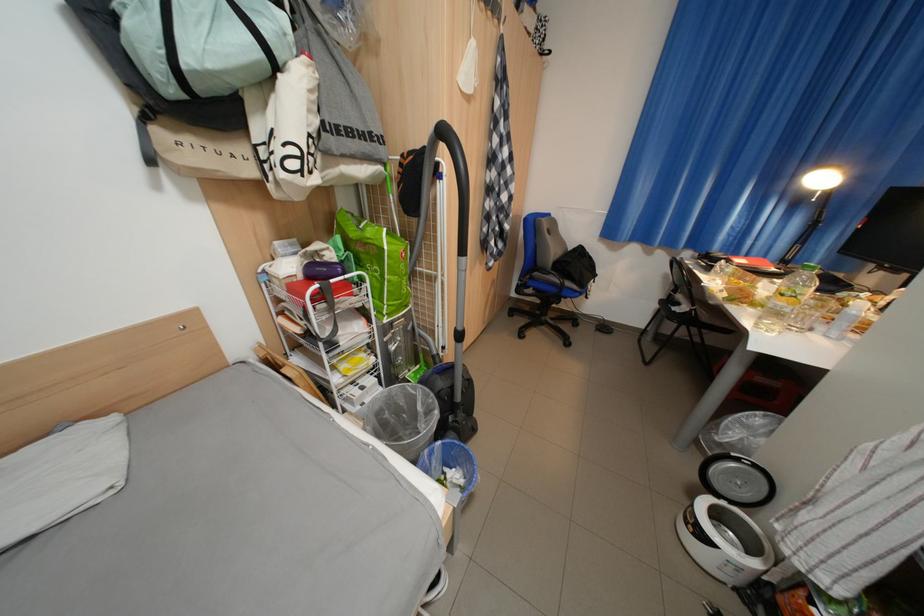
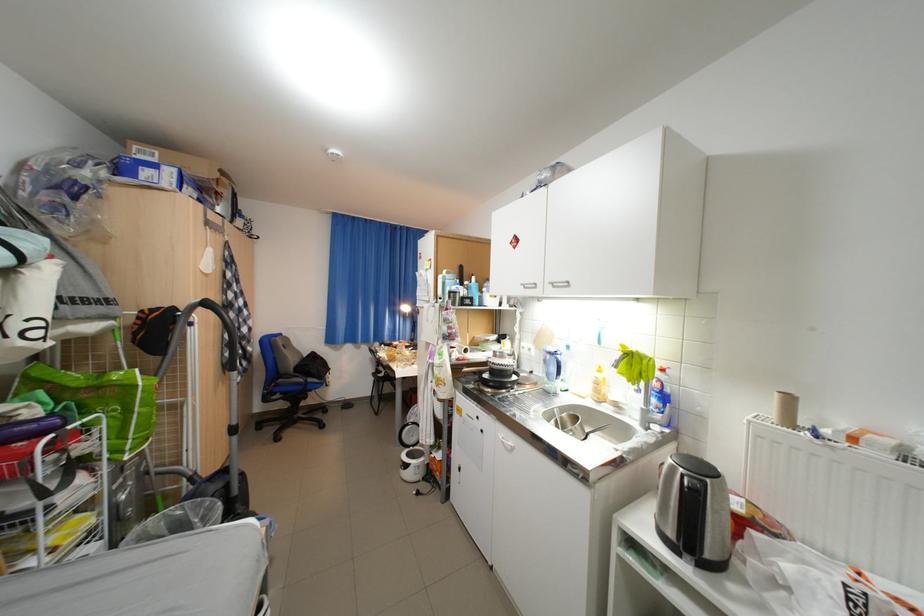
The point at (455, 132) is marked in the first image. Where is the corresponding point in the second image?

(217, 305)